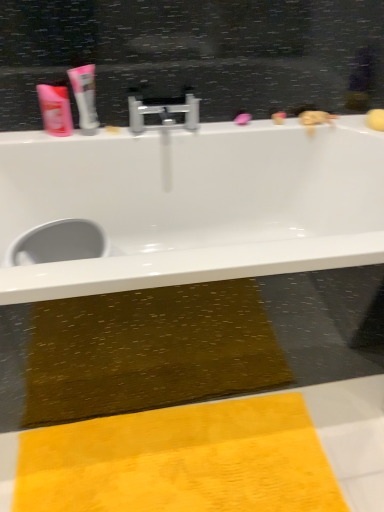
Image resolution: width=384 pixels, height=512 pixels. Describe the element at coordinates (194, 204) in the screenshot. I see `white glossy bathtub at upper center` at that location.

Image resolution: width=384 pixels, height=512 pixels. What do you see at coordinates (163, 112) in the screenshot?
I see `silver metallic faucet at center` at bounding box center [163, 112].

This screenshot has height=512, width=384. I want to click on yellow textured towel at lower center, so click(181, 461).

Describe the element at coordinates (55, 110) in the screenshot. I see `pink plastic shampoo at upper left` at that location.

Measure the distance between white glossy tube at upper left and camera.

white glossy tube at upper left is 1.26 meters from camera.

The width and height of the screenshot is (384, 512). I want to click on white glossy bathtub at upper center, so [x=194, y=204].

Based on the photo, is the position of silver metallic faucet at center more distant than that of pink plastic shampoo at upper left?

Yes, it is.

Between silver metallic faucet at center and pink plastic shampoo at upper left, which one has less height?

Standing shorter between the two is silver metallic faucet at center.

Is silver metallic faucet at center next to pink plastic shampoo at upper left and touching it?

No, silver metallic faucet at center is not next to pink plastic shampoo at upper left.

What's the angular difference between white glossy bathtub at upper center and pink plastic shampoo at upper left's facing directions?

white glossy bathtub at upper center and pink plastic shampoo at upper left are facing 0.00287 degrees away from each other.

Is white glossy bathtub at upper center spatially inside pink plastic shampoo at upper left, or outside of it?

white glossy bathtub at upper center is spatially situated outside pink plastic shampoo at upper left.

Is white glossy bathtub at upper center to the left of pink plastic shampoo at upper left from the viewer's perspective?

No, white glossy bathtub at upper center is not to the left of pink plastic shampoo at upper left.

Is pink plastic shampoo at upper left positioned far away from yellow textured towel at lower center?

pink plastic shampoo at upper left is far away from yellow textured towel at lower center.

From a real-world perspective, which is physically below, pink plastic shampoo at upper left or yellow textured towel at lower center?

From a 3D spatial view, yellow textured towel at lower center is below.

Between pink plastic shampoo at upper left and yellow textured towel at lower center, which one has larger size?

With larger size is yellow textured towel at lower center.

From the image's perspective, relative to yellow textured towel at lower center, is pink plastic shampoo at upper left above or below?

pink plastic shampoo at upper left is above yellow textured towel at lower center.

Would you say pink plastic shampoo at upper left contains white glossy bathtub at upper center?

No, white glossy bathtub at upper center is located outside of pink plastic shampoo at upper left.

The width and height of the screenshot is (384, 512). I want to click on bathtub that appears on the right of pink plastic shampoo at upper left, so click(x=194, y=204).

From the image's perspective, who appears lower, pink plastic shampoo at upper left or white glossy bathtub at upper center?

From the image's view, white glossy bathtub at upper center is below.

Could you tell me if pink plastic shampoo at upper left is facing white glossy bathtub at upper center?

No, pink plastic shampoo at upper left is not facing towards white glossy bathtub at upper center.

Between pink plastic shampoo at upper left and silver metallic faucet at center, which one has smaller size?

With smaller size is pink plastic shampoo at upper left.

Where is `tap behind the pink plastic shampoo at upper left`? This screenshot has width=384, height=512. tap behind the pink plastic shampoo at upper left is located at coordinates (163, 112).

Is pink plastic shampoo at upper left oriented towards silver metallic faucet at center?

No, pink plastic shampoo at upper left is not turned towards silver metallic faucet at center.

Would you say pink plastic shampoo at upper left is to the left or to the right of silver metallic faucet at center in the picture?

Clearly, pink plastic shampoo at upper left is on the left of silver metallic faucet at center in the image.

From a real-world perspective, which object stands above the other?

From a 3D spatial view, white glossy bathtub at upper center is above.

Is white glossy bathtub at upper center next to yellow textured towel at lower center and touching it?

No, white glossy bathtub at upper center is not making contact with yellow textured towel at lower center.

What's the angular difference between white glossy bathtub at upper center and yellow textured towel at lower center's facing directions?

They differ by 0.119 degrees in their facing directions.

Does point (178, 209) lie in front of point (168, 433)?

No.

Relative to pink plastic shampoo at upper left, is white glossy tube at upper left in front or behind?

In the image, white glossy tube at upper left appears in front of pink plastic shampoo at upper left.

Is white glossy tube at upper left placed right next to pink plastic shampoo at upper left?

Yes, white glossy tube at upper left is touching pink plastic shampoo at upper left.

Considering the sizes of objects white glossy tube at upper left and pink plastic shampoo at upper left in the image provided, who is wider, white glossy tube at upper left or pink plastic shampoo at upper left?

white glossy tube at upper left is wider.

Image resolution: width=384 pixels, height=512 pixels. Identify the location of toiletry below the silver metallic faucet at center (from the image's perspective). (55, 110).

At what (x,y) coordinates should I click in order to perform the action: click on bathtub in front of the pink plastic shampoo at upper left. Please return your answer as a coordinate pair (x, y). This screenshot has height=512, width=384. Looking at the image, I should click on (194, 204).

Based on their spatial positions, is white glossy tube at upper left or silver metallic faucet at center closer to white glossy bathtub at upper center?

silver metallic faucet at center.

When comparing their distances from pink plastic shampoo at upper left, does white glossy tube at upper left or white glossy bathtub at upper center seem closer?

Based on the image, white glossy tube at upper left appears to be nearer to pink plastic shampoo at upper left.

From the image, which object appears to be nearer to silver metallic faucet at center, white glossy bathtub at upper center or pink plastic shampoo at upper left?

pink plastic shampoo at upper left lies closer to silver metallic faucet at center than the other object.

Estimate the real-world distances between objects in this image. Which object is further from yellow textured towel at lower center, pink plastic shampoo at upper left or silver metallic faucet at center?

pink plastic shampoo at upper left is positioned further to the anchor yellow textured towel at lower center.

Which object lies nearer to the anchor point silver metallic faucet at center, pink plastic shampoo at upper left or white glossy bathtub at upper center?

pink plastic shampoo at upper left lies closer to silver metallic faucet at center than the other object.

Which object lies nearer to the anchor point white glossy bathtub at upper center, pink plastic shampoo at upper left or silver metallic faucet at center?

Based on the image, silver metallic faucet at center appears to be nearer to white glossy bathtub at upper center.

Estimate the real-world distances between objects in this image. Which object is closer to yellow textured towel at lower center, silver metallic faucet at center or white glossy bathtub at upper center?

white glossy bathtub at upper center.

Which object lies further to the anchor point white glossy bathtub at upper center, pink plastic shampoo at upper left or yellow textured towel at lower center?

yellow textured towel at lower center lies further to white glossy bathtub at upper center than the other object.

Identify the location of tap that lies between white glossy tube at upper left and yellow textured towel at lower center from top to bottom. This screenshot has width=384, height=512. (163, 112).

Where is `toiletry between white glossy bathtub at upper center and silver metallic faucet at center in the front-back direction`? Image resolution: width=384 pixels, height=512 pixels. toiletry between white glossy bathtub at upper center and silver metallic faucet at center in the front-back direction is located at coordinates (55, 110).

Locate an element on the screen. The width and height of the screenshot is (384, 512). bathtub between white glossy tube at upper left and yellow textured towel at lower center from top to bottom is located at coordinates (194, 204).

You are a GUI agent. You are given a task and a screenshot of the screen. Output one action in this format:
    pyautogui.click(x=<x>, y=<y>)
    Task: Click on the toothpaste between pink plastic shampoo at upper left and silver metallic faucet at center in the horizontal direction
    
    Given the screenshot: What is the action you would take?
    pyautogui.click(x=85, y=97)